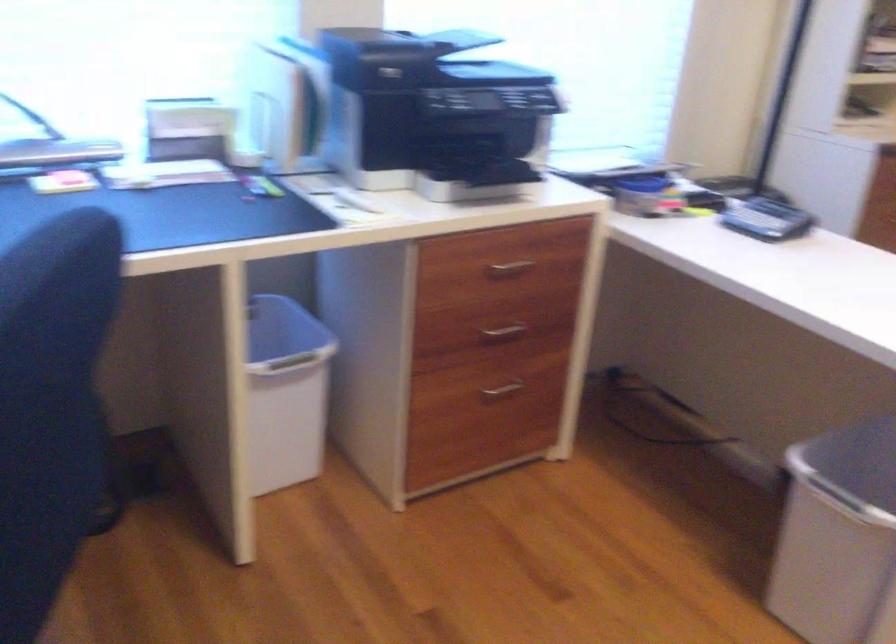
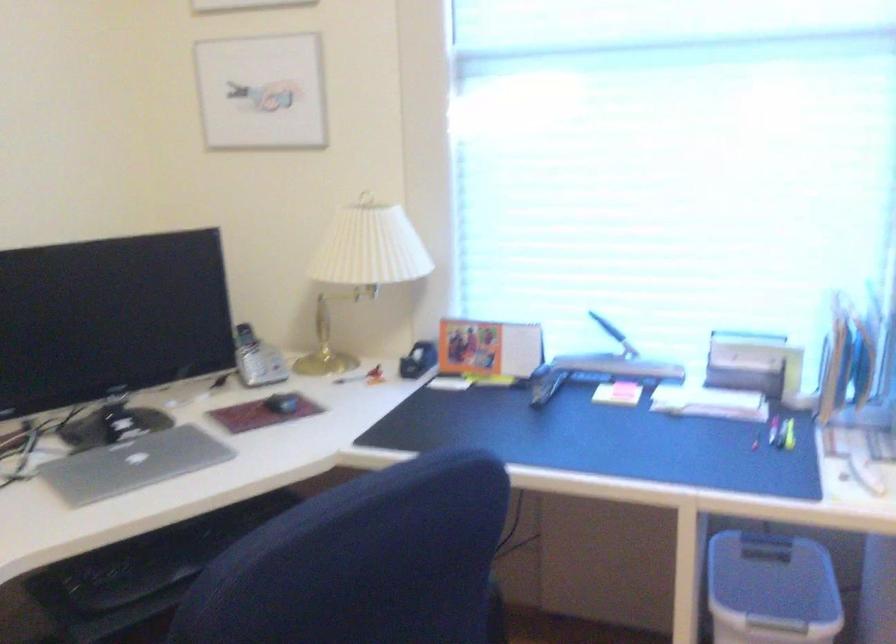
Question: The camera is either moving clockwise (left) or counter-clockwise (right) around the object. The first image is from the beginning of the video and the second image is from the end. Is the camera moving left or right when shooting the video?

Choices:
 (A) Left
 (B) Right

Answer: (B)